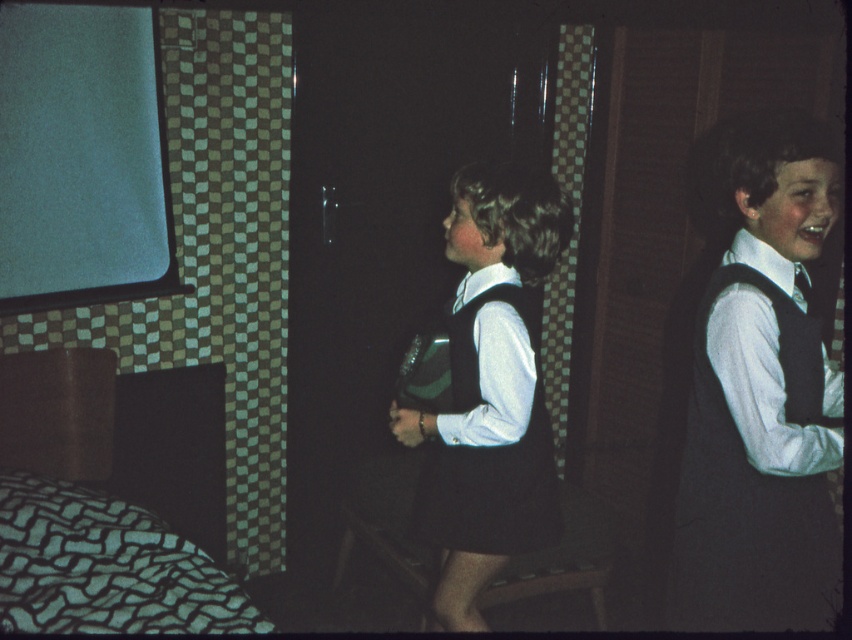
Can you confirm if matte black vest at right is positioned below silky black tie at right?

Yes.

Looking at this image, between matte black vest at right and silky black tie at right, which one appears on the right side from the viewer's perspective?

Positioned to the right is silky black tie at right.

This screenshot has width=852, height=640. I want to click on matte black vest at right, so click(760, 397).

Where is `matte black vest at right`? This screenshot has width=852, height=640. matte black vest at right is located at coordinates (760, 397).

Is matte black vest at right shorter than white matte dress at center?

No.

Between matte black vest at right and white matte dress at center, which one is positioned lower?

white matte dress at center is below.

Is point (750, 465) more distant than point (476, 508)?

No, it is not.

Find the location of a particular element. This screenshot has height=640, width=852. matte black vest at right is located at coordinates (760, 397).

Does matte black vest at right have a greater width compared to green textured fabric bed at lower left?

No.

Is point (728, 536) closer to camera compared to point (122, 396)?

Yes, point (728, 536) is in front of point (122, 396).

Image resolution: width=852 pixels, height=640 pixels. In order to click on matte black vest at right in this screenshot , I will do `click(760, 397)`.